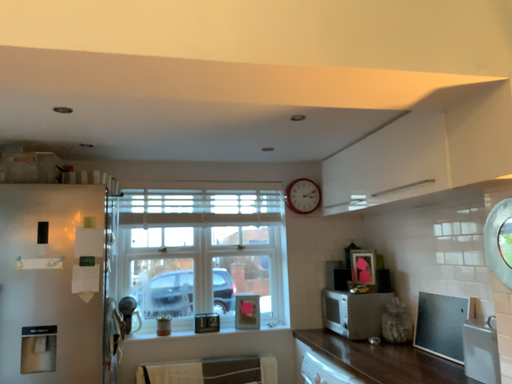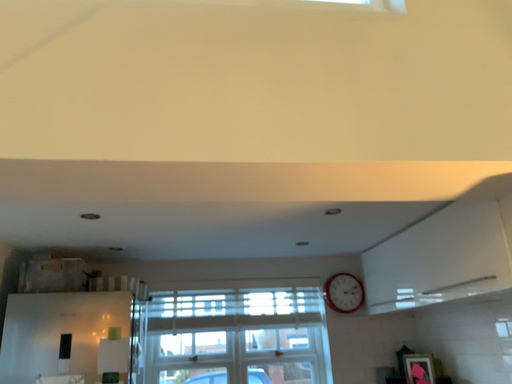
Question: Which way did the camera rotate in the video?

Choices:
 (A) rotated downward
 (B) rotated upward

Answer: (B)